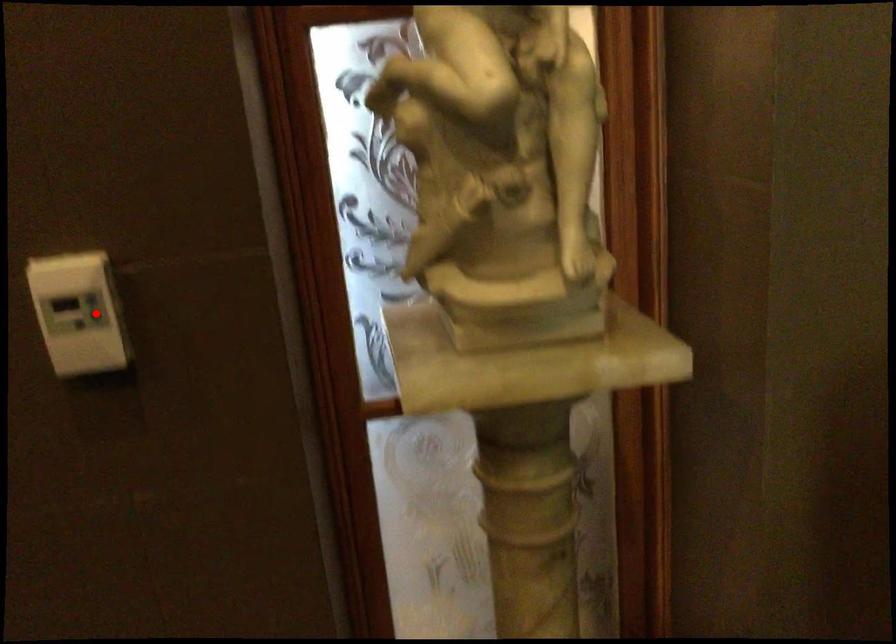
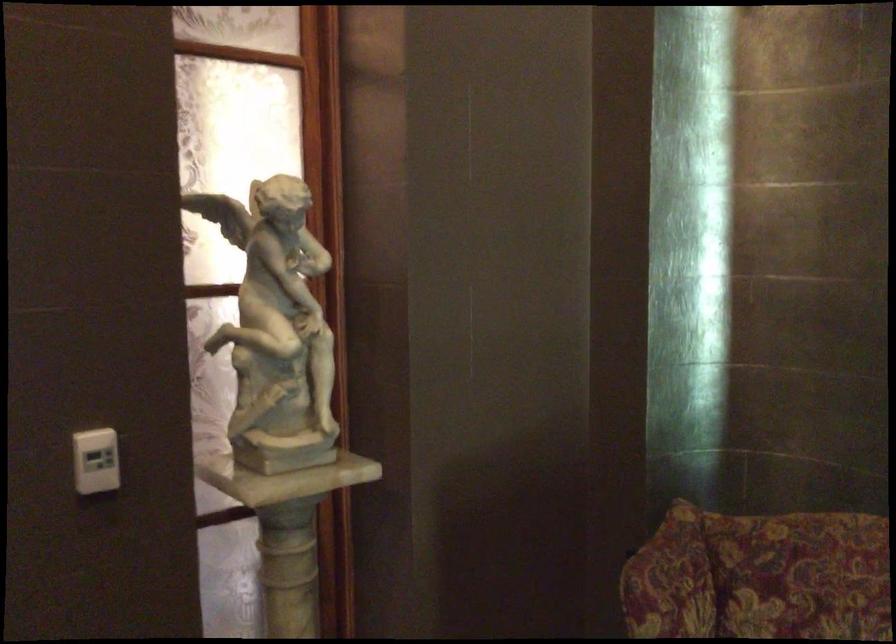
In the second image, find the point that corresponds to the highlighted location in the first image.

(95, 460)